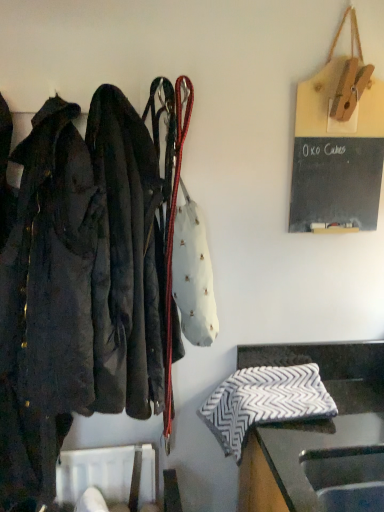
Question: Is point (354, 353) closer or farther from the camera than point (334, 473)?

Choices:
 (A) farther
 (B) closer

Answer: (A)

Question: Considering the positions of black and white zigzag-patterned cloth at lower right and black plastic sink at lower right in the image, is black and white zigzag-patterned cloth at lower right wider or thinner than black plastic sink at lower right?

Choices:
 (A) wide
 (B) thin

Answer: (A)

Question: Considering the real-world distances, which object is closest to the wooden clipboard at upper right?

Choices:
 (A) dark brown leather jacket at left
 (B) black and white zigzag-patterned cloth at lower right
 (C) white leather handbag at center
 (D) gray and white zigzag-patterned cloth at lower right
 (E) black plastic sink at lower right

Answer: (C)

Question: Estimate the real-world distances between objects in this image. Which object is closer to the black plastic sink at lower right?

Choices:
 (A) wooden clipboard at upper right
 (B) gray and white zigzag-patterned cloth at lower right
 (C) black and white zigzag-patterned cloth at lower right
 (D) white leather handbag at center
 (E) dark brown leather jacket at left

Answer: (C)